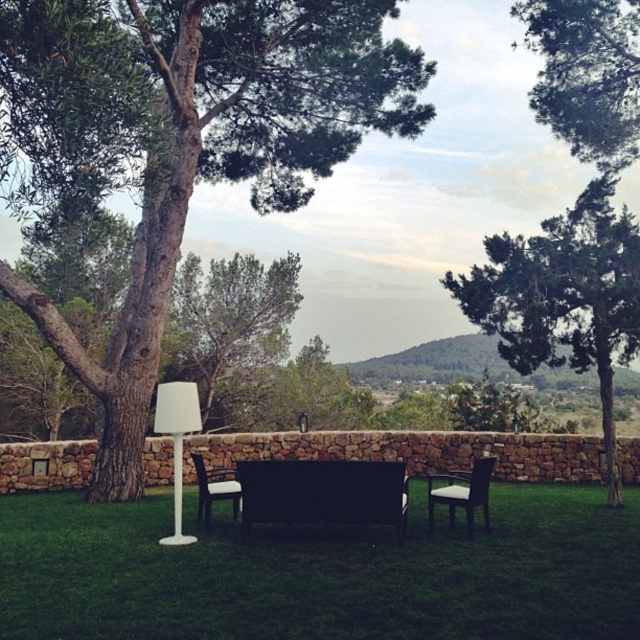
You are planning to place a small potted plant between the black leather park bench at center and the black leather chair at right. Considering their heights, which object should the plant be placed closer to?

The black leather park bench at center is shorter than the black leather chair at right, so the plant should be placed closer to the black leather park bench at center to maintain visual balance.

Based on the provided coordinates, where is the green leafy tree at upper right located in the image?

The green leafy tree at upper right is located at point (586, 74) in the image.

You are sitting on the black leather park bench at center and want to move to the black leather chair at right. Which direction should you walk to get closer to the chair?

Since the black leather park bench at center is closer to the viewer than the black leather chair at right, you should walk forward towards the chair to get closer to it.